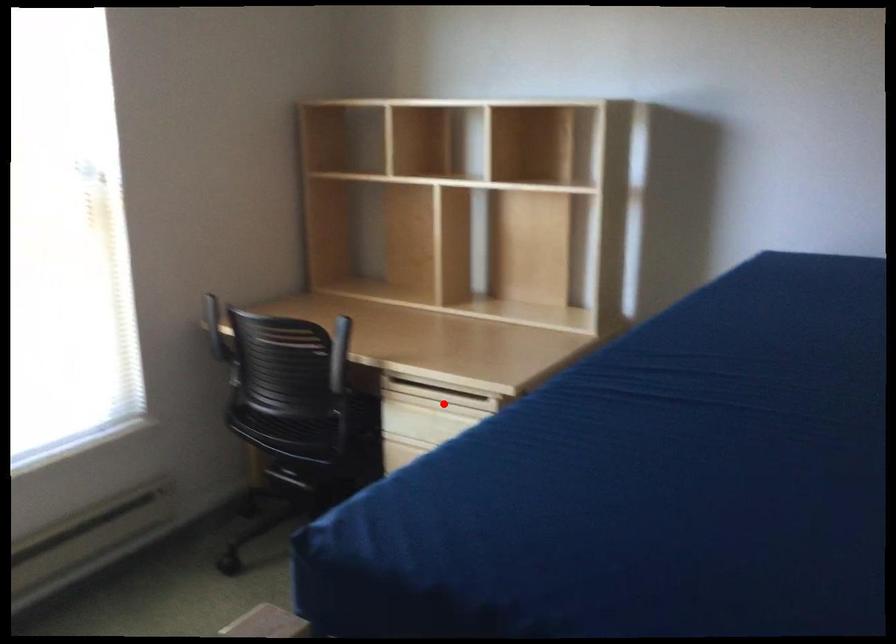
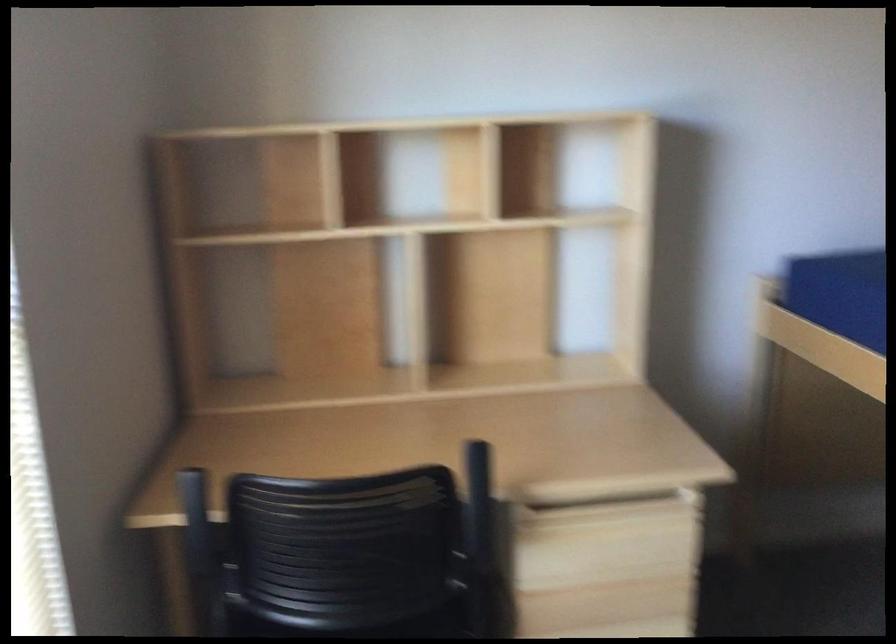
Question: I am providing you with two images of the same scene from different viewpoints. In image1, a red point is highlighted. Considering the same 3D point in image2, which of the following is correct?

Choices:
 (A) It is closer
 (B) It is farther

Answer: (A)